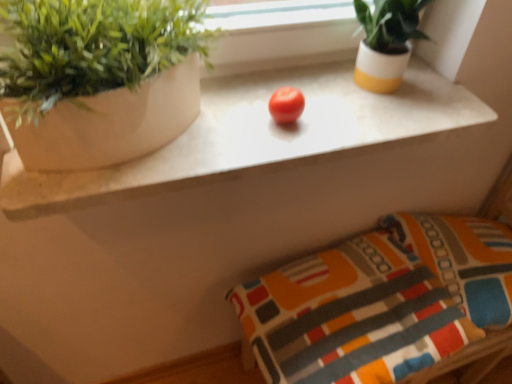
The width and height of the screenshot is (512, 384). Find the location of `vacant space behind red matte tomato at center`. vacant space behind red matte tomato at center is located at coordinates (290, 82).